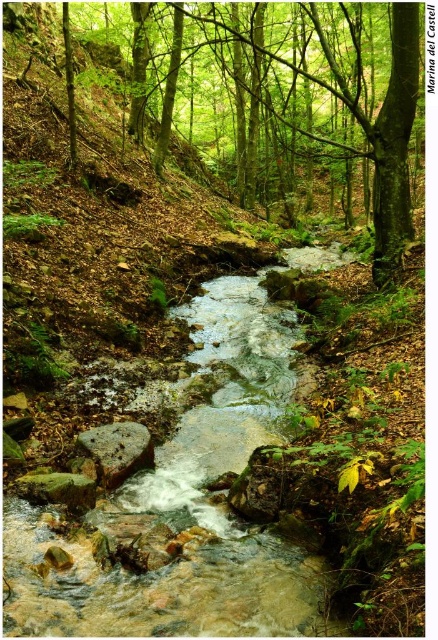
You are standing at the point with coordinates point (x=116, y=433) and want to see if you can see the point (x=412, y=120). Given the dense forest and stream in the scene, can you see it directly?

Point (x=412, y=120) is behind point (x=116, y=433), so you cannot see it directly due to the obstruction from the dense forest and stream between them.

You are a hiker who wants to cross the stream in the forest. You see the green leafy tree at center and the smooth gray rock at center. How far apart are these two landmarks?

The green leafy tree at center is 20.18 meters from the smooth gray rock at center, so the distance between them is 20.18 meters.

You are a hiker trying to cross the stream in the forest. You see the green leafy tree at center and the smooth gray rock at center. Which object can you use as a stepping stone to cross the stream safely?

The smooth gray rock at center can be used as a stepping stone to cross the stream safely because it is positioned in the stream and has a stable surface, unlike the green leafy tree at center which is a tree and cannot be stepped on.